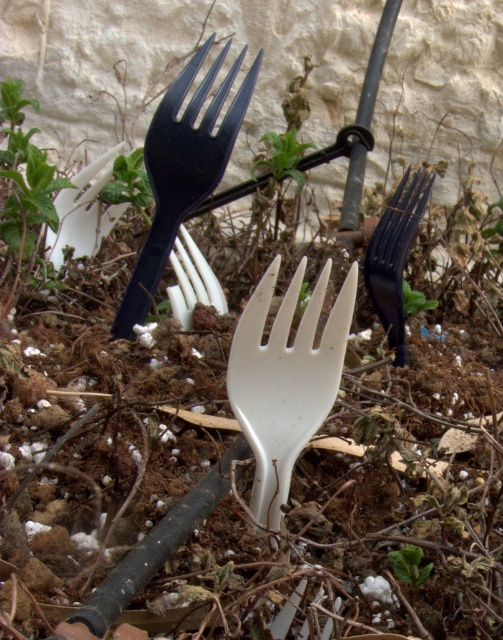
In the scene shown: You are a gardener trying to remove weeds from the soil. You notice the white matte fork at center and the green leafy weed at lower center. Which object is taller and needs to be carefully avoided to prevent damaging the weed?

The white matte fork at center is much taller than the green leafy weed at lower center, so you should avoid stepping on the white matte fork at center to protect the weed.

You are a gardener trying to remove items from the soil. You have a tool that can only pick up objects wider than 10 cm. Based on the scene, can you determine if the black plastic fork at upper left or the green leafy weed at lower center can be picked up by your tool?

The black plastic fork at upper left is wider than the green leafy weed at lower center. Since the tool requires objects wider than 10 cm, if the black plastic fork at upper left meets this criterion, it can be picked up. However, without specific measurements, we can only confirm its relative width compared to the weed.

You are a gardener trying to remove weeds from the soil. You notice the black plastic fork at upper left and the green leafy weed at lower center. Which object is positioned higher up in the image?

The black plastic fork at upper left is located above the green leafy weed at lower center, so it is positioned higher up in the image.